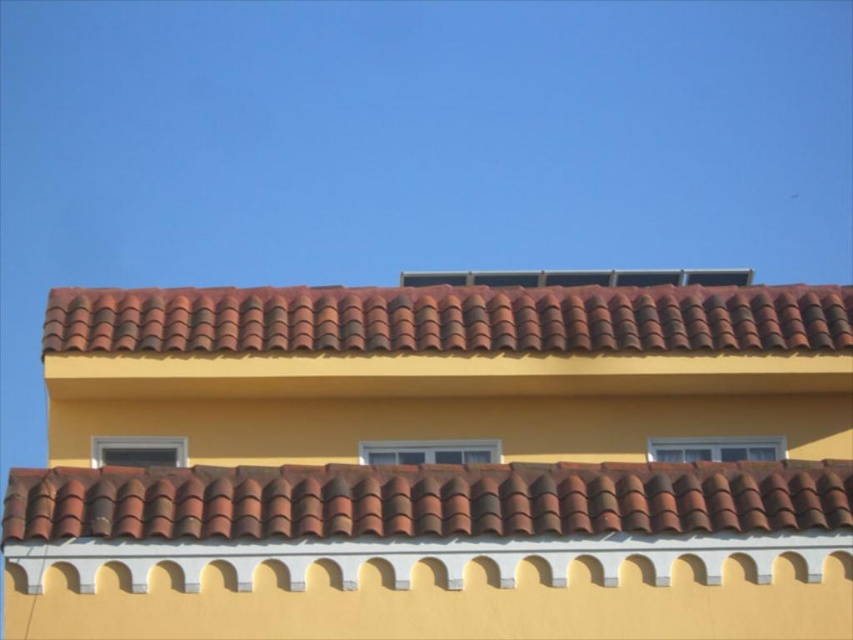
You are an architect designing a new building and want to ensure proper drainage. You notice two sections of the roof covered with brown clay tiles at center and brown clay tiles at top. Which section of the roof has tiles that are thinner and might require more attention for water runoff?

The brown clay tiles at center are thinner than the brown clay tiles at top, so they might require more attention for water runoff.

You are a drone operator trying to locate a specific point on a roof. The point is marked as point (425, 500). Based on the scene description, what feature is located at this point?

The point (425, 500) marks brown clay tiles at center.

You are a maintenance worker inspecting the roof. You notice two sets of brown clay tiles at center and brown clay tiles at top. Which set is located below the other?

The brown clay tiles at center is positioned under brown clay tiles at top, so the brown clay tiles at center are below the brown clay tiles at top.